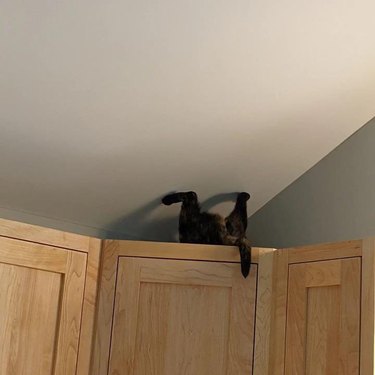
Identify the location of angle of cabinets. The width and height of the screenshot is (375, 375). (93, 346).